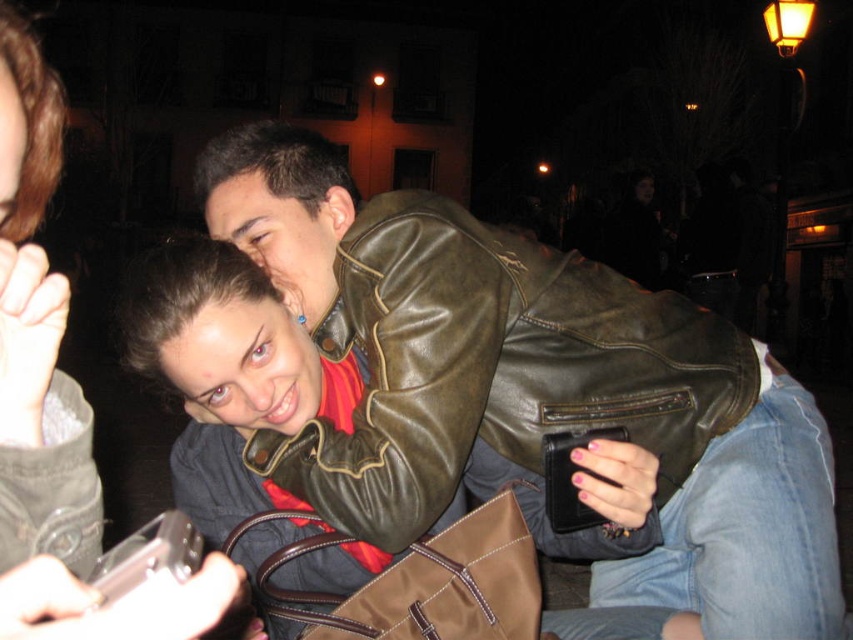
Question: Observing the image, what is the correct spatial positioning of shiny brown leather jacket at center in reference to matte black phone at lower left?

Choices:
 (A) left
 (B) right

Answer: (B)

Question: Can you confirm if shiny brown leather jacket at center is smaller than matte black phone at lower left?

Choices:
 (A) yes
 (B) no

Answer: (B)

Question: Which point is closer to the camera taking this photo?

Choices:
 (A) pos(73,595)
 (B) pos(392,314)

Answer: (A)

Question: Does shiny brown leather jacket at center have a larger size compared to matte black phone at lower left?

Choices:
 (A) yes
 (B) no

Answer: (A)

Question: Which point is farther to the camera?

Choices:
 (A) (683, 460)
 (B) (24, 468)

Answer: (A)

Question: Among these points, which one is nearest to the camera?

Choices:
 (A) (3, 374)
 (B) (305, 486)

Answer: (A)